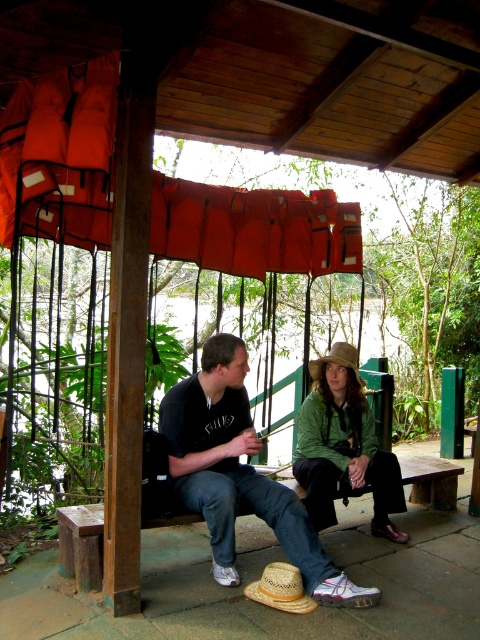
You are standing at the center of the image and see the matte black shirt at center. Can you confirm if the matte black shirt at center is located exactly at the point with coordinates (x=240, y=474)?

Yes, the matte black shirt at center is located exactly at the point with coordinates (x=240, y=474).